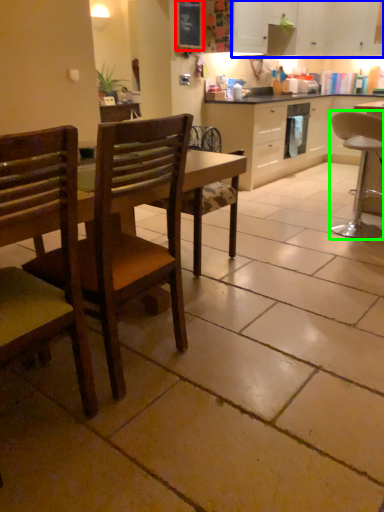
Question: Which is nearer to the bulletin board (highlighted by a red box)? cabinetry (highlighted by a blue box) or chair (highlighted by a green box).

Choices:
 (A) cabinetry
 (B) chair

Answer: (A)